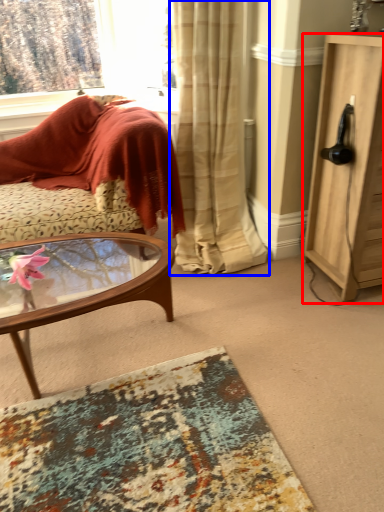
Question: Which of the following is the closest to the observer, cabinetry (highlighted by a red box) or curtain (highlighted by a blue box)?

Choices:
 (A) cabinetry
 (B) curtain

Answer: (A)